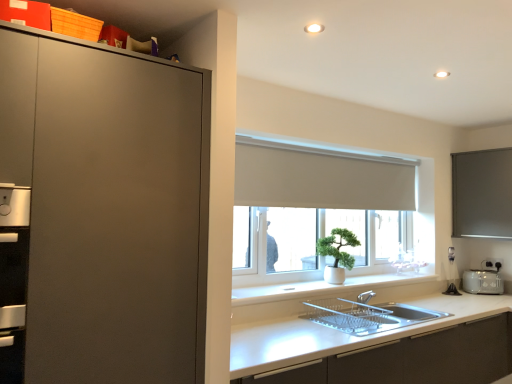
Describe the element at coordinates (482, 282) in the screenshot. Image resolution: width=512 pixels, height=384 pixels. I see `white plastic toaster at right` at that location.

This screenshot has height=384, width=512. What are the coordinates of `matte gray window screen at right` in the screenshot? It's located at (482, 194).

Could you tell me if white matte cabinet at lower center is turned towards white plastic toaster at right?

No, white matte cabinet at lower center does not turn towards white plastic toaster at right.

From a real-world perspective, between white matte cabinet at lower center and white plastic toaster at right, who is vertically higher?

white plastic toaster at right.

Which of these two, white matte cabinet at lower center or white plastic toaster at right, stands taller?

With more height is white matte cabinet at lower center.

Locate an element on the screen. appliance positioned vertically above the white matte cabinet at lower center (from a real-world perspective) is located at coordinates (482, 282).

Are matte gray window screen at right and white plastic toaster at right beside each other?

There is a gap between matte gray window screen at right and white plastic toaster at right.

Can white plastic toaster at right be found inside matte gray window screen at right?

A: No, white plastic toaster at right is not a part of matte gray window screen at right.

Image resolution: width=512 pixels, height=384 pixels. I want to click on appliance below the matte gray window screen at right (from the image's perspective), so click(x=482, y=282).

Considering the sizes of objects matte gray window screen at right and white plastic toaster at right in the image provided, who is wider, matte gray window screen at right or white plastic toaster at right?

Wider between the two is matte gray window screen at right.

Is white plastic toaster at right wider than white matte window at center?

Indeed, white plastic toaster at right has a greater width compared to white matte window at center.

Is white plastic toaster at right at the right side of white matte window at center?

Yes, white plastic toaster at right is to the right of white matte window at center.

From a real-world perspective, is white plastic toaster at right over white matte window at center?

Incorrect, from a real-world perspective, white plastic toaster at right is lower than white matte window at center.

Which of these two, white plastic toaster at right or white matte window at center, stands taller?

Standing taller between the two is white matte window at center.

From a real-world perspective, is matte gray window screen at right physically located above or below white matte window at center?

From a real-world perspective, matte gray window screen at right is physically above white matte window at center.

Consider the image. Is matte gray window screen at right smaller than white matte window at center?

Yes, matte gray window screen at right is smaller than white matte window at center.

Image resolution: width=512 pixels, height=384 pixels. Find the location of `window below the matte gray window screen at right (from the image's perspective)`. window below the matte gray window screen at right (from the image's perspective) is located at coordinates (331, 213).

Does point (459, 157) lie in front of point (259, 234)?

That is False.

From the image's perspective, is white plastic toaster at right above or below white smooth window sill at center?

white plastic toaster at right is situated lower than white smooth window sill at center in the image.

Measure the distance between white plastic toaster at right and white smooth window sill at center.

white plastic toaster at right is 32.65 inches away from white smooth window sill at center.

Can you tell me how much white plastic toaster at right and white smooth window sill at center differ in facing direction?

The angle between the facing direction of white plastic toaster at right and the facing direction of white smooth window sill at center is 43 degrees.

Find the location of a particular element. window sill in front of the white plastic toaster at right is located at coordinates (322, 288).

From a real-world perspective, is matte gray window screen at right physically located above or below white smooth window sill at center?

In terms of real-world spatial position, matte gray window screen at right is above white smooth window sill at center.

Is point (462, 234) positioned before point (375, 284)?

No.

Is matte gray window screen at right taller than white smooth window sill at center?

Indeed, matte gray window screen at right has a greater height compared to white smooth window sill at center.

From the picture: Which object is wider, matte gray window screen at right or white smooth window sill at center?

Wider between the two is matte gray window screen at right.

Is white matte window at center oriented away from white plastic toaster at right?

white matte window at center is not turned away from white plastic toaster at right.

Between white matte window at center and white plastic toaster at right, which one appears on the left side from the viewer's perspective?

white matte window at center.

From the image's perspective, is white matte window at center positioned above or below white plastic toaster at right?

Clearly, from the image's perspective, white matte window at center is above white plastic toaster at right.

Considering the sizes of objects white matte window at center and white plastic toaster at right in the image provided, who is taller, white matte window at center or white plastic toaster at right?

With more height is white matte window at center.

This screenshot has width=512, height=384. Identify the location of cabinetry that appears below the white plastic toaster at right (from the image's perspective). (412, 358).

Where is `window screen above the white plastic toaster at right (from a real-world perspective)`? window screen above the white plastic toaster at right (from a real-world perspective) is located at coordinates (482, 194).

Considering their positions, is white matte cabinet at lower center positioned closer to white plastic toaster at right than white smooth window sill at center?

white smooth window sill at center is positioned closer to the anchor white plastic toaster at right.

Which object lies nearer to the anchor point white matte window at center, white matte cabinet at lower center or white plastic toaster at right?

white matte cabinet at lower center lies closer to white matte window at center than the other object.

Based on their spatial positions, is white plastic toaster at right or white matte window at center further from matte gray window screen at right?

white matte window at center lies further to matte gray window screen at right than the other object.

When comparing their distances from white matte window at center, does matte gray window screen at right or white plastic toaster at right seem closer?

matte gray window screen at right.

When comparing their distances from matte gray window screen at right, does white smooth window sill at center or white plastic toaster at right seem further?

white smooth window sill at center lies further to matte gray window screen at right than the other object.

From the image, which object appears to be farther from white smooth window sill at center, white plastic toaster at right or matte gray window screen at right?

matte gray window screen at right is further to white smooth window sill at center.

From the image, which object appears to be nearer to matte gray window screen at right, white matte cabinet at lower center or white plastic toaster at right?

The object closer to matte gray window screen at right is white plastic toaster at right.

Which object lies further to the anchor point white matte cabinet at lower center, white plastic toaster at right or matte gray window screen at right?

matte gray window screen at right is further to white matte cabinet at lower center.

Find the location of a particular element. The image size is (512, 384). window between white matte cabinet at lower center and matte gray window screen at right in the front-back direction is located at coordinates (331, 213).

Locate an element on the screen. window sill located between white matte cabinet at lower center and white plastic toaster at right in the depth direction is located at coordinates (322, 288).

Find the location of `window sill between white matte window at center and matte gray window screen at right from left to right`. window sill between white matte window at center and matte gray window screen at right from left to right is located at coordinates tap(322, 288).

What are the coordinates of `appliance between white smooth window sill at center and matte gray window screen at right in the horizontal direction` in the screenshot? It's located at (482, 282).